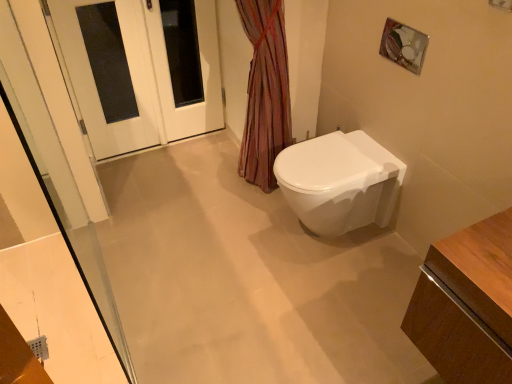
You are a GUI agent. You are given a task and a screenshot of the screen. Output one action in this format:
    pyautogui.click(x=<x>, y=<y>)
    Task: Click on the vacant area that lies to the right of white glossy door at upper left
    The height and width of the screenshot is (384, 512).
    Given the screenshot: What is the action you would take?
    (206, 161)